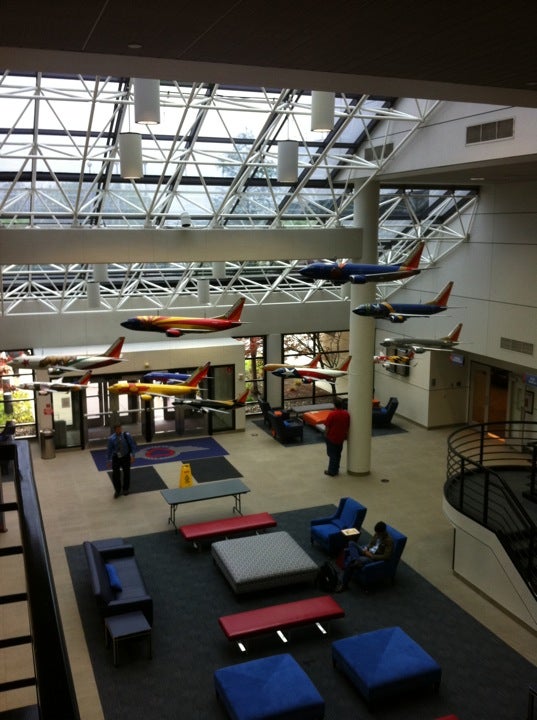
The image size is (537, 720). I want to click on bench, so click(278, 615), click(211, 530), click(290, 680), click(359, 652).